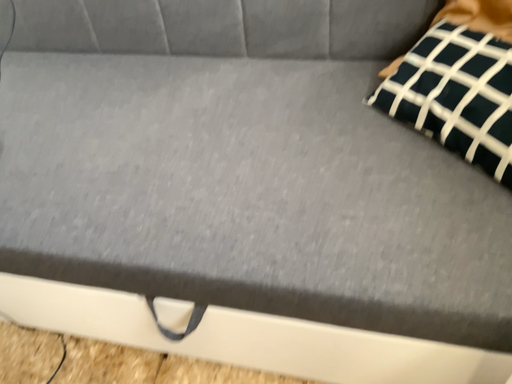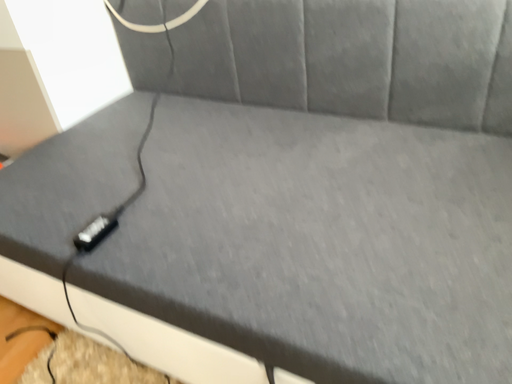
Question: How did the camera likely rotate when shooting the video?

Choices:
 (A) rotated downward
 (B) rotated upward

Answer: (B)